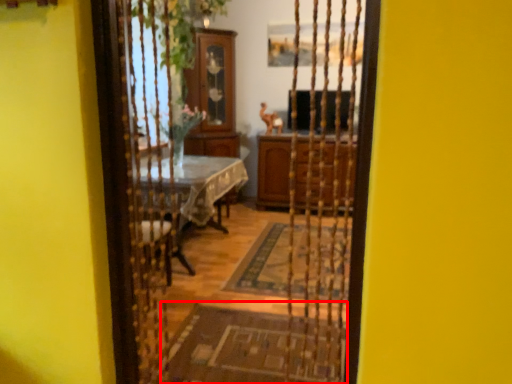
Question: In this image, where is doormat (annotated by the red box) located relative to cabinetry?

Choices:
 (A) left
 (B) right

Answer: (A)